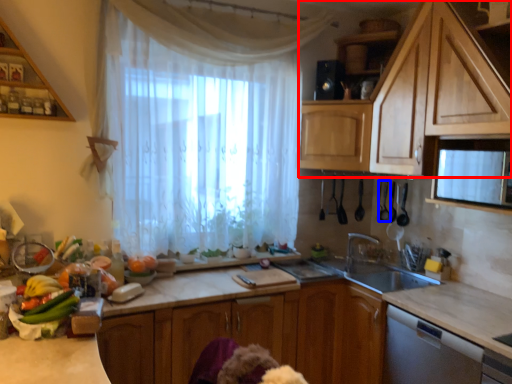
Question: Which point is further to the camera, cabinetry (highlighted by a red box) or appliance (highlighted by a blue box)?

Choices:
 (A) cabinetry
 (B) appliance

Answer: (B)